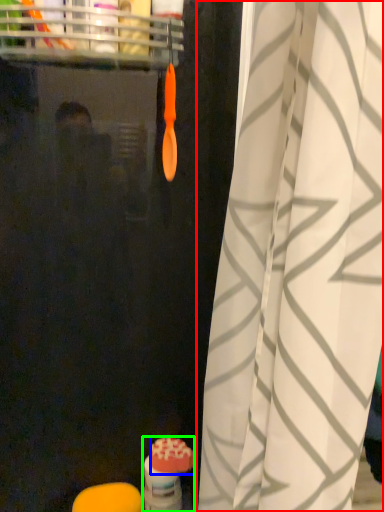
Question: Considering the real-world distances, which object is farthest from curtain (highlighted by a red box)? soap (highlighted by a blue box) or toiletry (highlighted by a green box)?

Choices:
 (A) soap
 (B) toiletry

Answer: (A)